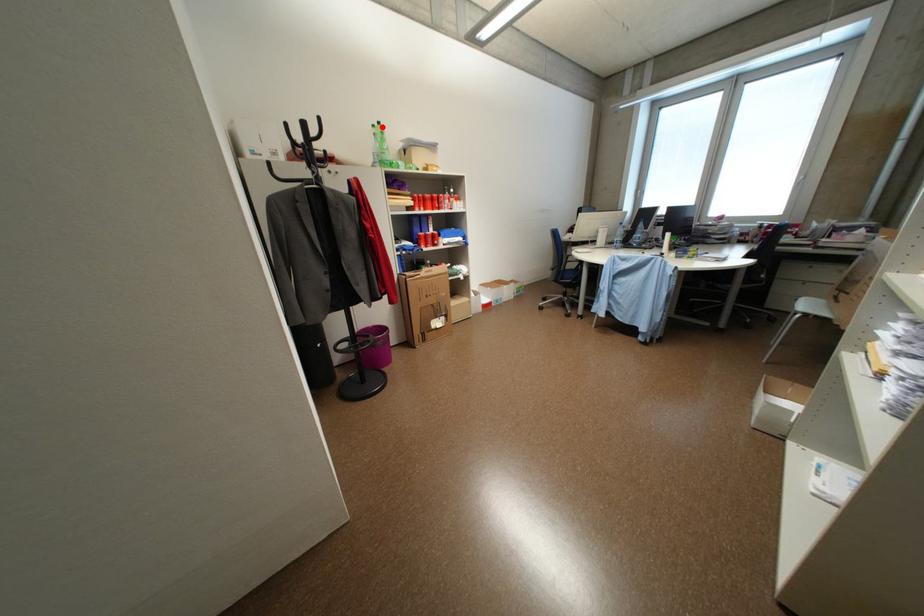
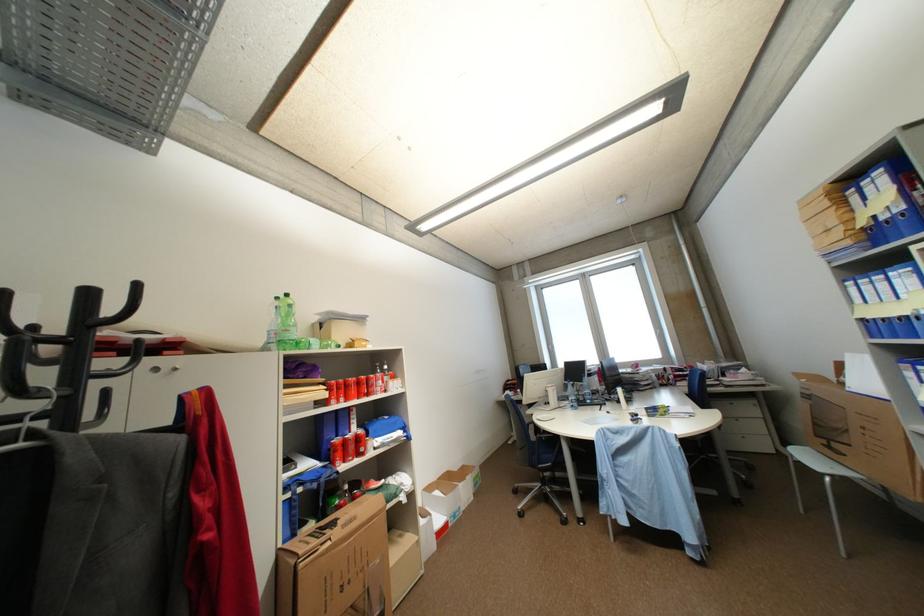
Locate, in the second image, the point that corresponds to the highlighted location in the first image.

(286, 300)